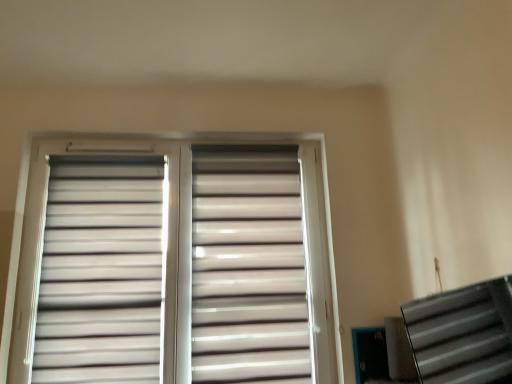
Question: Is metallic silver stairwell at lower right taller or shorter than matte white blinds at center?

Choices:
 (A) short
 (B) tall

Answer: (A)

Question: Is metallic silver stairwell at lower right to the left or to the right of matte white blinds at center in the image?

Choices:
 (A) right
 (B) left

Answer: (A)

Question: Which object is positioned farthest from the white matte shutter at upper left, the first shutter viewed from the left?

Choices:
 (A) metallic silver stairwell at lower right
 (B) matte white shutter at center, which is counted as the 2th shutter, starting from the left
 (C) matte white blinds at center

Answer: (A)

Question: Estimate the real-world distances between objects in this image. Which object is farther from the matte white shutter at center, which is counted as the 2th shutter, starting from the left?

Choices:
 (A) matte white blinds at center
 (B) metallic silver stairwell at lower right
 (C) white matte shutter at upper left, acting as the 2th shutter starting from the right

Answer: (B)